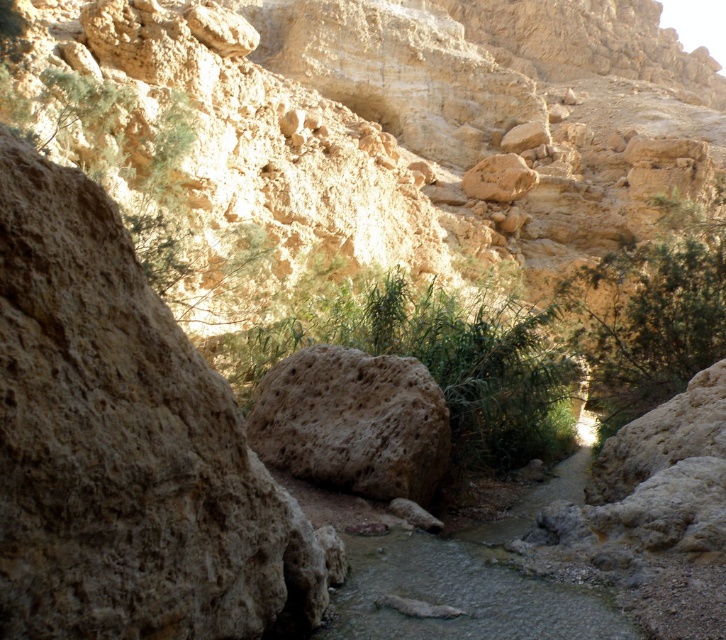
You are hiking through the canyon and want to take a photo of the brown rough rock at left and the green leafy bush at center. Which object should you focus on first if you want both to be in clear focus?

The brown rough rock at left is shorter than the green leafy bush at center, so you should focus on the green leafy bush at center first to ensure both are in clear focus.

You are standing at the entrance of the canyon and see two points marked on the canyon wall. The first point is at coordinate point(73, 449) and the second is at point(274, 406). Which point is closer to you?

Point(73, 449) is in front of point(274, 406), so it is closer to you.

You are a hiker trying to cross the narrow canyon. You see a green leafy bush at center and a brown porous rock at center. Which one is wider so you can choose the best path?

The green leafy bush at center is wider than the brown porous rock at center, so you should choose the path around the brown porous rock at center.